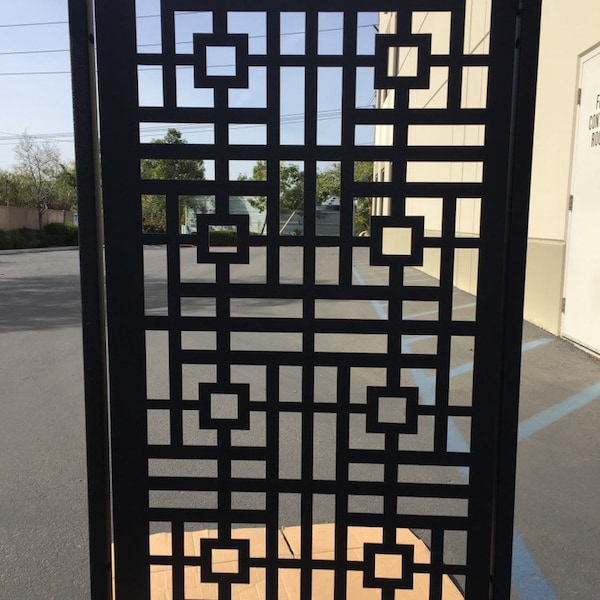
At what (x,y) coordinates should I click in order to perform the action: click on tan wall. Please return your answer as a coordinate pair (x, y). Image resolution: width=600 pixels, height=600 pixels. Looking at the image, I should click on (599, 266), (399, 245).